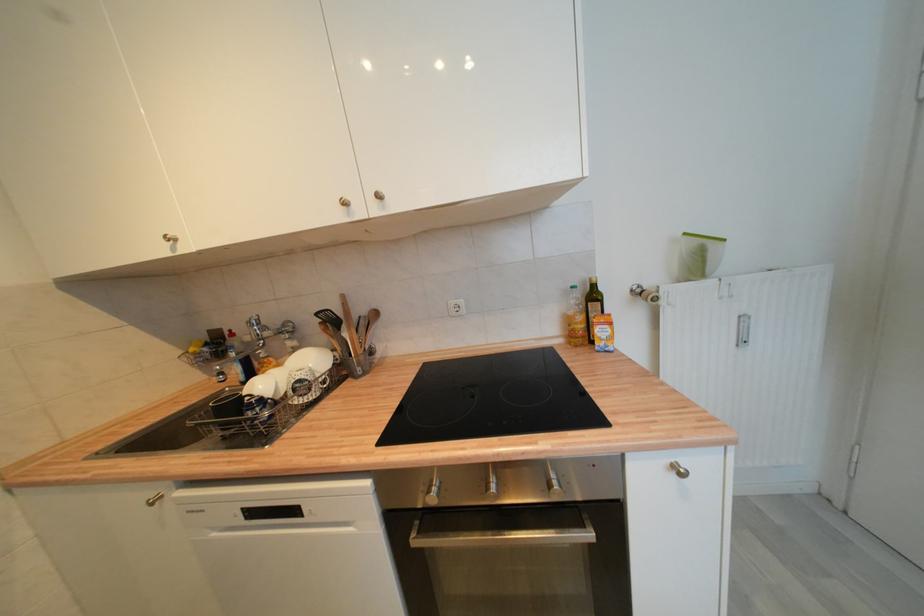
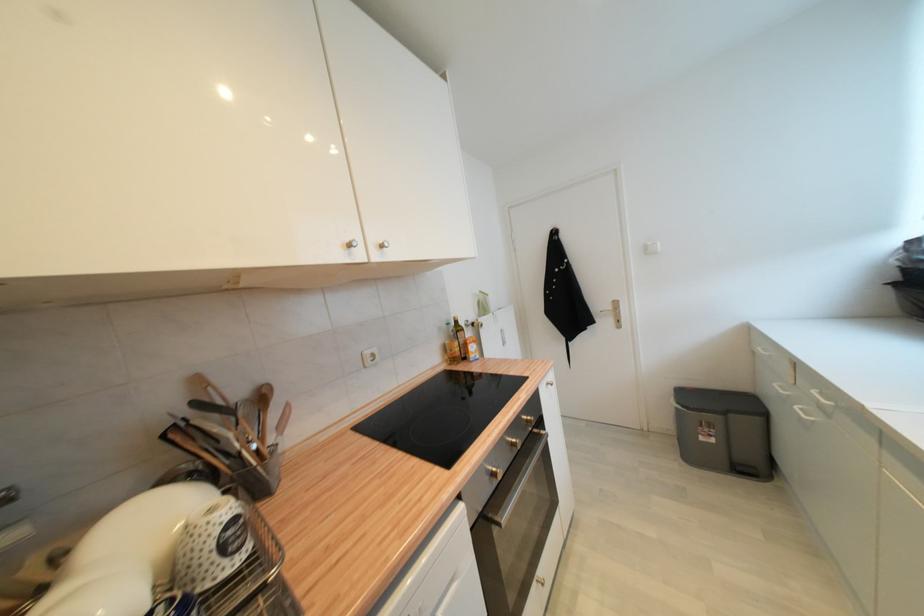
Question: The images are taken continuously from a first-person perspective. In which direction is your viewpoint rotating?

Choices:
 (A) Left
 (B) Right
 (C) Up
 (D) Down

Answer: (B)